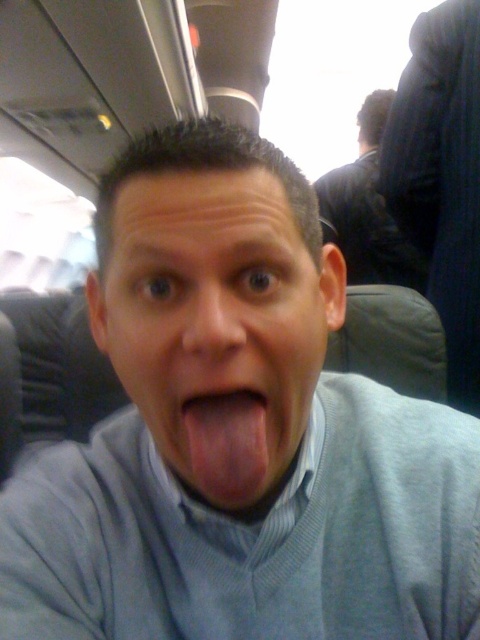
Who is shorter, dark blue sweater at upper right or smooth skin nose at center?

smooth skin nose at center

Looking at this image, is dark blue sweater at upper right taller than smooth skin nose at center?

Indeed, dark blue sweater at upper right has a greater height compared to smooth skin nose at center.

Between point (420, 262) and point (179, 300), which one is positioned behind?

Point (420, 262)

I want to click on dark blue sweater at upper right, so click(x=367, y=209).

Is pink flesh-colored tongue at center taller than smooth skin nose at center?

No.

Which is in front, point (211, 448) or point (194, 317)?

Point (194, 317) is more forward.

You are a GUI agent. You are given a task and a screenshot of the screen. Output one action in this format:
    pyautogui.click(x=<x>, y=<y>)
    Task: Click on the pink flesh-colored tongue at center
    The image size is (480, 640).
    Given the screenshot: What is the action you would take?
    (227, 449)

Is gray matte face at center to the right of pink flesh-colored tongue at center from the viewer's perspective?

No, gray matte face at center is not to the right of pink flesh-colored tongue at center.

Locate an element on the screen. Image resolution: width=480 pixels, height=640 pixels. gray matte face at center is located at coordinates (216, 324).